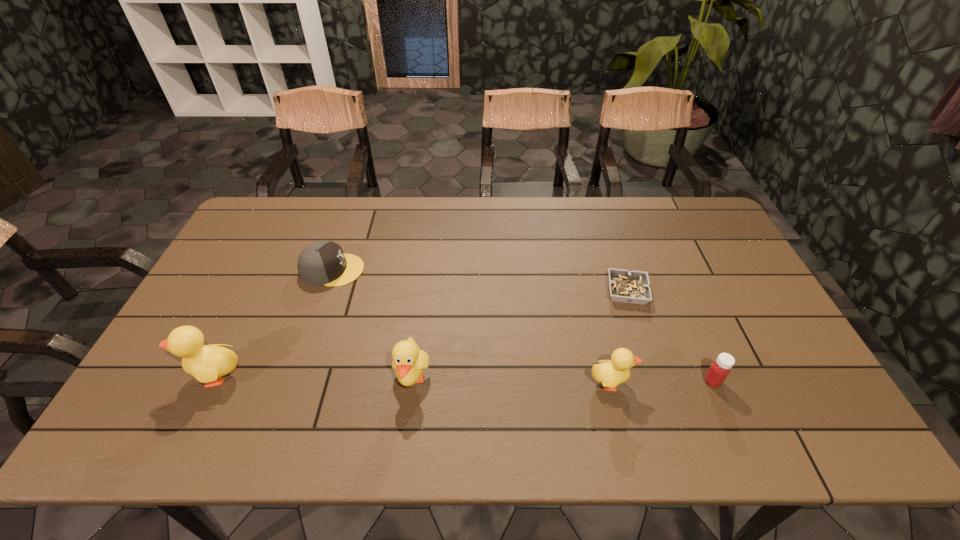
The image size is (960, 540). Identify the location of empty space that is in between the fifth object from right to left and the rightmost object. (522, 326).

You are a GUI agent. You are given a task and a screenshot of the screen. Output one action in this format:
    pyautogui.click(x=<x>, y=<y>)
    Task: Click on the second closest object to the shortest object
    
    Given the screenshot: What is the action you would take?
    pyautogui.click(x=720, y=368)

Select which object appears as the fourth closest to the leftmost duckling. Please provide its 2D coordinates. Your answer should be formatted as a tuple, i.e. [(x, y)], where the tuple contains the x and y coordinates of a point satisfying the conditions above.

[(632, 287)]

Select which duckling appears as the closest to the rightmost duckling. Please provide its 2D coordinates. Your answer should be formatted as a tuple, i.e. [(x, y)], where the tuple contains the x and y coordinates of a point satisfying the conditions above.

[(409, 361)]

Point out which duckling is positioned as the nearest to the rightmost object. Please provide its 2D coordinates. Your answer should be formatted as a tuple, i.e. [(x, y)], where the tuple contains the x and y coordinates of a point satisfying the conditions above.

[(610, 373)]

The image size is (960, 540). Identify the location of free location that satisfies the following two spatial constraints: 1. on the front side of the shortest object; 2. on the front-facing side of the fourth shortest object. (656, 382).

Where is `blank space that satisfies the following two spatial constraints: 1. on the front side of the ashtray; 2. on the front-facing side of the leftmost duckling`? blank space that satisfies the following two spatial constraints: 1. on the front side of the ashtray; 2. on the front-facing side of the leftmost duckling is located at coordinates (654, 375).

Find the location of a particular element. This screenshot has height=540, width=960. free space that satisfies the following two spatial constraints: 1. on the front-facing side of the leftmost object; 2. on the left side of the rightmost object is located at coordinates (212, 381).

In order to click on vacant space that satisfies the following two spatial constraints: 1. on the front-facing side of the shortest object; 2. on the left side of the fifth object from right to left in this screenshot , I will do `click(325, 292)`.